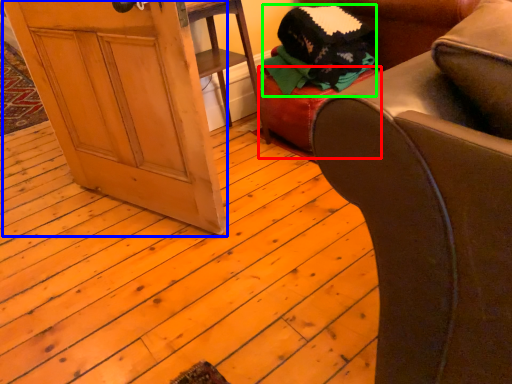
Question: Based on their relative distances, which object is farther from stool (highlighted by a red box)? Choose from screen door (highlighted by a blue box) and clothing (highlighted by a green box).

Choices:
 (A) screen door
 (B) clothing

Answer: (A)